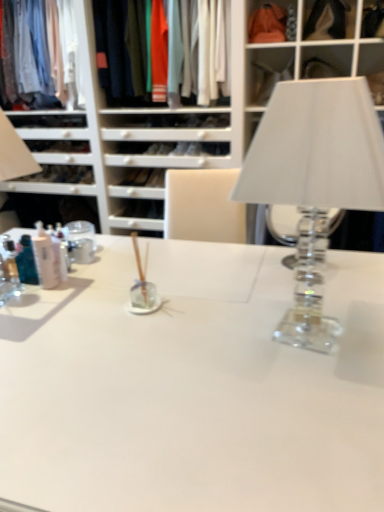
Question: Is translucent plastic bottles at left wider than matte cotton shirts at upper center, which is the 2th clothing from left to right?

Choices:
 (A) yes
 (B) no

Answer: (B)

Question: Is translucent plastic bottles at left facing towards matte cotton shirts at upper center, the 1th clothing from the right?

Choices:
 (A) no
 (B) yes

Answer: (A)

Question: From a real-world perspective, does translucent plastic bottles at left sit lower than matte cotton shirts at upper center, which is the 2th clothing from left to right?

Choices:
 (A) yes
 (B) no

Answer: (A)

Question: Is translucent plastic bottles at left in contact with matte cotton shirts at upper center, which is the 2th clothing from left to right?

Choices:
 (A) yes
 (B) no

Answer: (B)

Question: Is translucent plastic bottles at left smaller than matte cotton shirts at upper center, the 1th clothing from the right?

Choices:
 (A) yes
 (B) no

Answer: (A)

Question: Is point (288, 31) positioned closer to the camera than point (137, 77)?

Choices:
 (A) closer
 (B) farther

Answer: (A)

Question: From the image's perspective, is matte orange fabric at upper center positioned above or below matte cotton shirts at upper center, the 1th clothing from the right?

Choices:
 (A) above
 (B) below

Answer: (A)

Question: From a real-world perspective, is matte orange fabric at upper center positioned above or below matte cotton shirts at upper center, which is the 2th clothing from left to right?

Choices:
 (A) above
 (B) below

Answer: (A)

Question: Is matte orange fabric at upper center spatially inside matte cotton shirts at upper center, the 1th clothing from the right, or outside of it?

Choices:
 (A) outside
 (B) inside

Answer: (A)

Question: Would you say matte cotton shirts at upper center, which is the 2th clothing from left to right, is inside or outside matte orange fabric at upper center?

Choices:
 (A) inside
 (B) outside

Answer: (B)

Question: Would you say matte cotton shirts at upper center, which is the 2th clothing from left to right, is to the left or to the right of matte orange fabric at upper center in the picture?

Choices:
 (A) right
 (B) left

Answer: (B)

Question: From the image's perspective, relative to matte orange fabric at upper center, is matte cotton shirts at upper center, the 1th clothing from the right, above or below?

Choices:
 (A) above
 (B) below

Answer: (B)

Question: Looking at their shapes, would you say matte cotton shirts at upper center, which is the 2th clothing from left to right, is wider or thinner than matte orange fabric at upper center?

Choices:
 (A) thin
 (B) wide

Answer: (B)

Question: Considering their positions, is clear glass table lamp at right located in front of or behind matte cotton shirt at upper left, placed as the second clothing when sorted from right to left?

Choices:
 (A) front
 (B) behind

Answer: (A)

Question: From the image's perspective, is clear glass table lamp at right above or below matte cotton shirt at upper left, placed as the second clothing when sorted from right to left?

Choices:
 (A) below
 (B) above

Answer: (A)